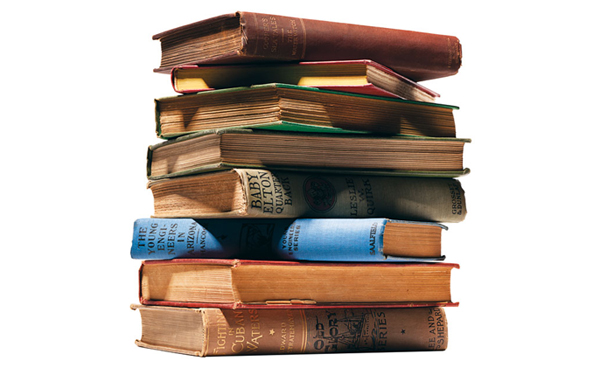
This screenshot has height=368, width=600. I want to click on stacked hardcover books, so click(x=283, y=32), click(x=342, y=74), click(x=294, y=106), click(x=271, y=149), click(x=267, y=194), click(x=303, y=240), click(x=273, y=281), click(x=269, y=328).